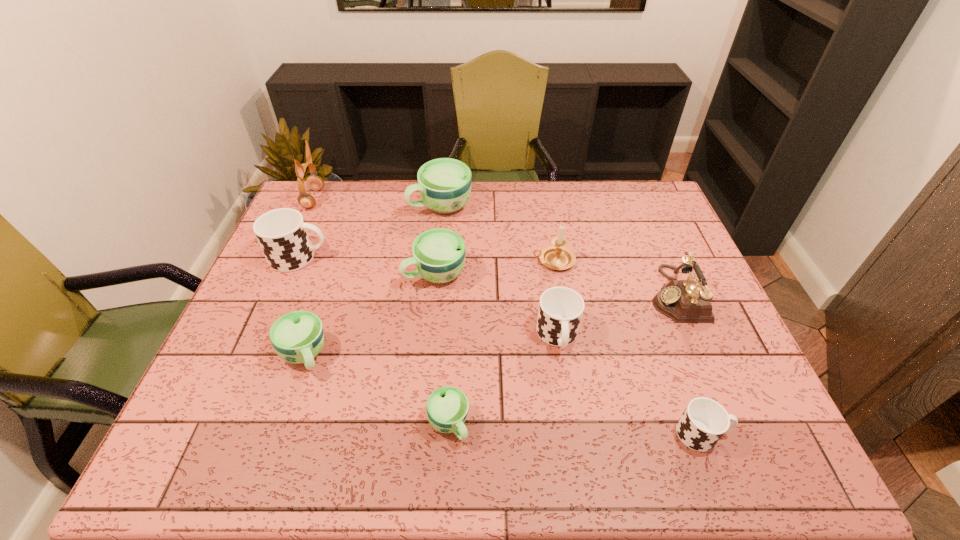
This screenshot has height=540, width=960. In order to click on vacant space at the left edge of the desktop in this screenshot , I will do pos(255,284).

In the image, there is a desktop. What are the coordinates of `vacant space at the right edge` in the screenshot? It's located at (710, 353).

In the image, there is a desktop. Identify the location of vacant space at the near left corner. This screenshot has width=960, height=540. (205, 460).

Where is `free space at the far right corner`? Image resolution: width=960 pixels, height=540 pixels. free space at the far right corner is located at coordinates (629, 188).

Identify the location of free space between the third smallest blue cup and the black telephone. (555, 284).

The image size is (960, 540). Identify the location of empty space between the telephone and the shortest object. (562, 359).

The width and height of the screenshot is (960, 540). Identify the location of empty space that is in between the rightmost cup and the earphone. (508, 316).

Where is `free space between the shortest object and the third smallest blue cup`? The height and width of the screenshot is (540, 960). free space between the shortest object and the third smallest blue cup is located at coordinates (442, 349).

Locate an element on the screen. vacant space in between the biggest black cup and the third nearest blue cup is located at coordinates (368, 266).

This screenshot has width=960, height=540. Identify the location of unoccupied position between the smallest black cup and the shortest object. (575, 429).